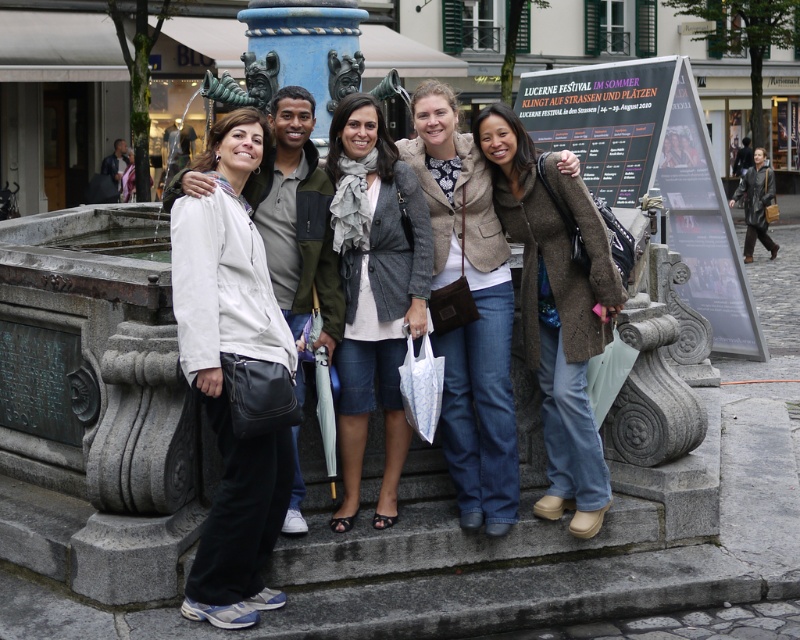
You are a photographer trying to focus on the white matte jacket at center and the gray woolen scarf at center in the image. Which one should you adjust your camera lens to focus on first if you want to capture both clearly?

The white matte jacket at center is closer to the viewer than the gray woolen scarf at center, so focus on the white matte jacket at center first to ensure both are in focus.